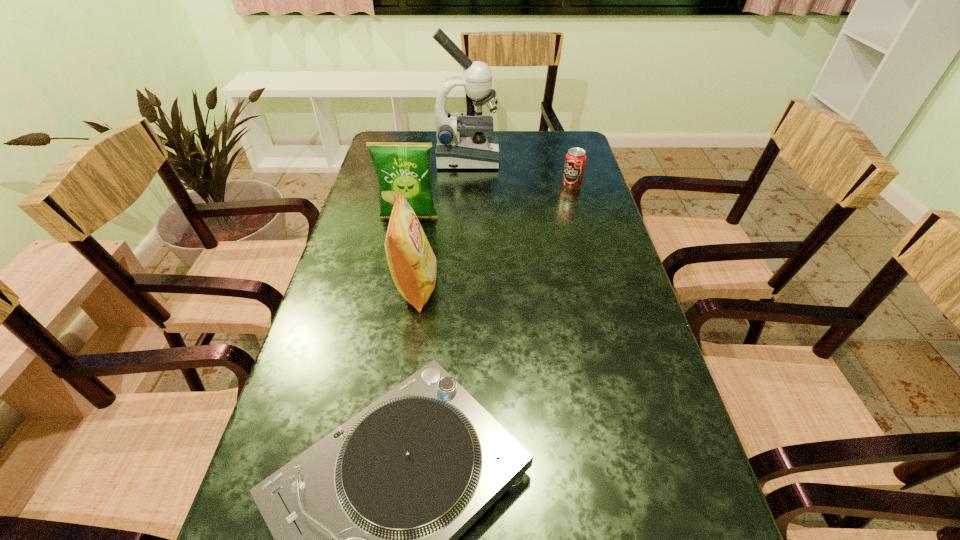
The image size is (960, 540). What are the coordinates of `object that is positioned at the far edge` in the screenshot? It's located at (456, 148).

This screenshot has width=960, height=540. I want to click on object located in the left edge section of the desktop, so click(x=406, y=166).

The width and height of the screenshot is (960, 540). Identify the location of object located at the right edge. (575, 159).

Where is `free space at the left edge`? Image resolution: width=960 pixels, height=540 pixels. free space at the left edge is located at coordinates (357, 219).

The image size is (960, 540). I want to click on free space at the right edge of the desktop, so click(569, 296).

Locate an element on the screen. This screenshot has width=960, height=540. free space at the far right corner of the desktop is located at coordinates (553, 163).

This screenshot has height=540, width=960. What are the coordinates of `vacant space that is in between the rightmost object and the second nearest object` in the screenshot? It's located at (493, 237).

The image size is (960, 540). Find the location of `free space between the tallest object and the rightmost object`. free space between the tallest object and the rightmost object is located at coordinates (519, 172).

This screenshot has width=960, height=540. Identify the location of free space between the farthest object and the second nearest object. (442, 223).

Locate which object ranks second in proximity to the rightmost object. Please provide its 2D coordinates. Your answer should be formatted as a tuple, i.e. [(x, y)], where the tuple contains the x and y coordinates of a point satisfying the conditions above.

[(406, 166)]